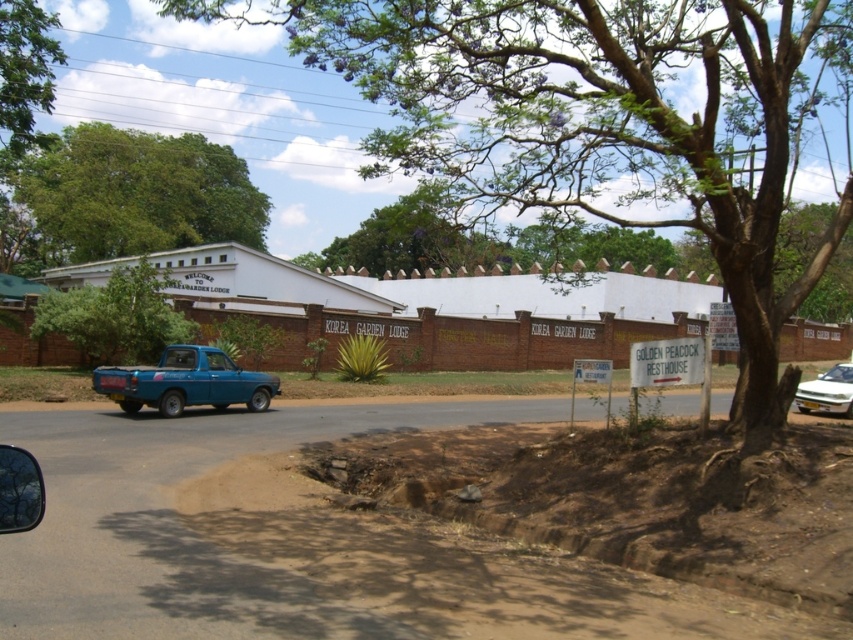
Question: Which object is positioned closest to the white glossy car at right?

Choices:
 (A) green leafy tree at upper center
 (B) matte blue pickup truck at left
 (C) green leafy tree at upper left

Answer: (B)

Question: Can you confirm if green leafy tree at upper left is smaller than white glossy car at right?

Choices:
 (A) yes
 (B) no

Answer: (B)

Question: Is green leafy tree at upper center smaller than matte blue pickup truck at left?

Choices:
 (A) yes
 (B) no

Answer: (B)

Question: Which object appears farthest from the camera in this image?

Choices:
 (A) green leafy tree at center
 (B) matte blue pickup truck at left

Answer: (A)

Question: Among these objects, which one is farthest from the camera?

Choices:
 (A) green leafy tree at upper left
 (B) green leafy tree at center

Answer: (A)

Question: Is brown dirt track at lower center wider than matte blue pickup truck at left?

Choices:
 (A) no
 (B) yes

Answer: (B)